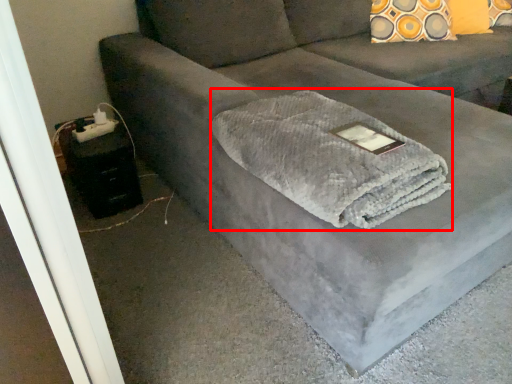
Question: From the image's perspective, where is bath towel (annotated by the red box) located relative to table?

Choices:
 (A) below
 (B) above

Answer: (B)